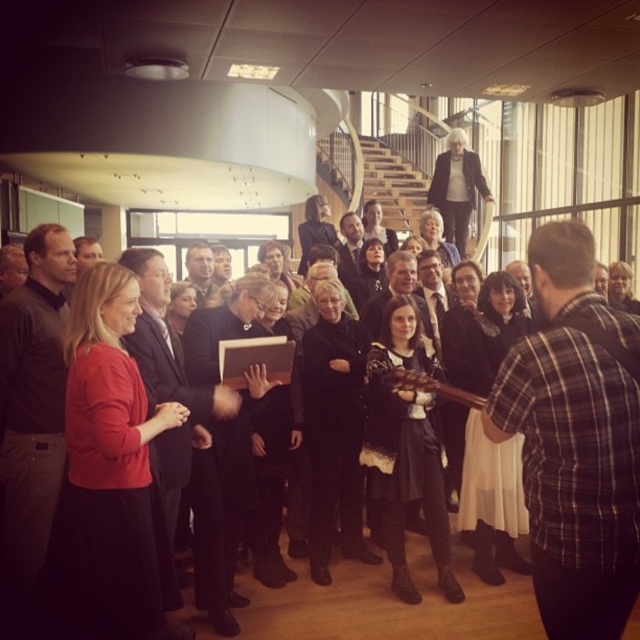
You are standing at the base of the curved staircase in the room. You see two points marked in the scene, point 1 at coordinates point (20, 566) and point 2 at coordinates point (202, 492). Which point is closer to you?

Point (20, 566) is in front of point (202, 492), so point (20, 566) is closer to you.

You are organizing a photo shoot and need to ensure that the matte black suit at center and the dark gray shirt at left are both visible in the frame. Given their positions, which one is closer to the camera?

The dark gray shirt at left is closer to the camera because the matte black suit at center is behind it.